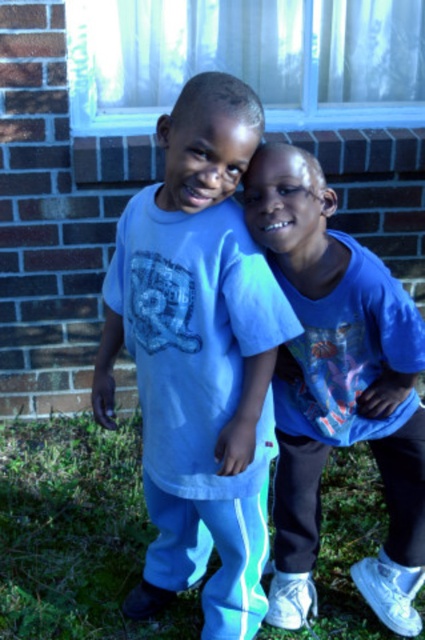
You are a photographer trying to capture both the light blue cotton shirt at center and the green grass at lower center in a single shot. Considering their sizes, which object will appear larger in the photo?

The green grass at lower center will appear larger in the photo because it has a bigger size compared to the light blue cotton shirt at center.